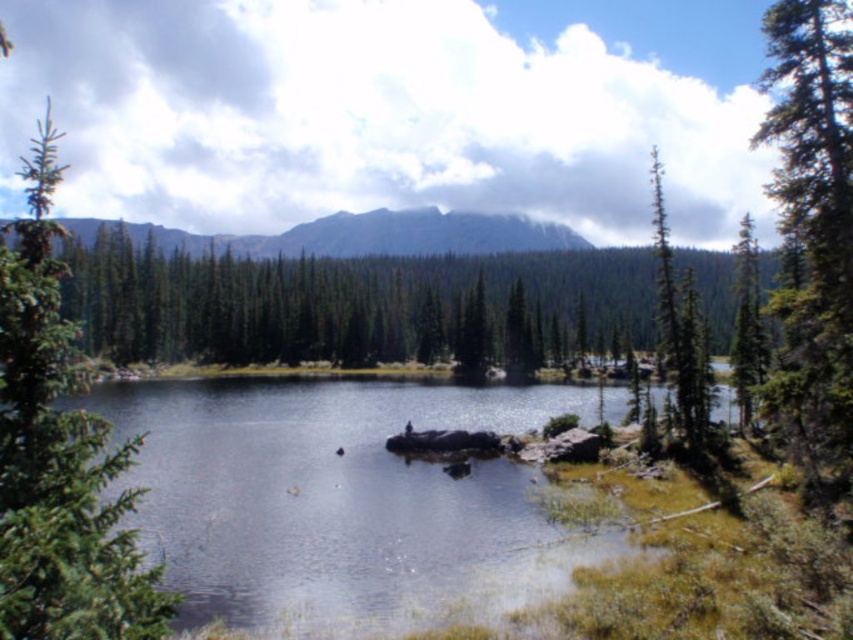
Question: Which point is farther to the camera?

Choices:
 (A) green matte tree at left
 (B) smooth rock at center

Answer: (B)

Question: Does green matte tree at left have a smaller size compared to green textured tree at right?

Choices:
 (A) yes
 (B) no

Answer: (B)

Question: Which is nearer to the green textured tree at upper right?

Choices:
 (A) smooth rock at center
 (B) green matte tree at left
 (C) green textured tree at right
 (D) rugged granite mountain at upper center

Answer: (C)

Question: Which point is closer to the camera?

Choices:
 (A) (22, 291)
 (B) (741, 410)

Answer: (A)

Question: Is green matte tree at left closer to the viewer compared to green textured tree at right?

Choices:
 (A) yes
 (B) no

Answer: (A)

Question: Does green matte tree at left appear over green matte tree at right?

Choices:
 (A) no
 (B) yes

Answer: (B)